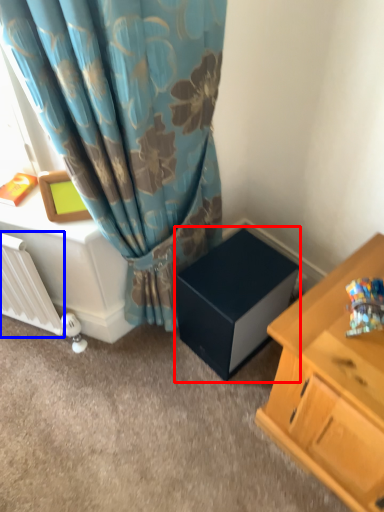
Question: Which of the following is the closest to the observer, cardboard box (highlighted by a red box) or radiator (highlighted by a blue box)?

Choices:
 (A) cardboard box
 (B) radiator

Answer: (B)